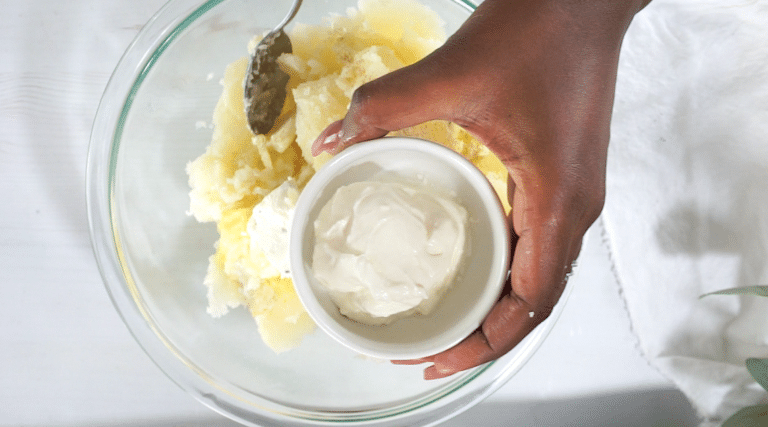
Find the location of `spoon`. spoon is located at coordinates (262, 96).